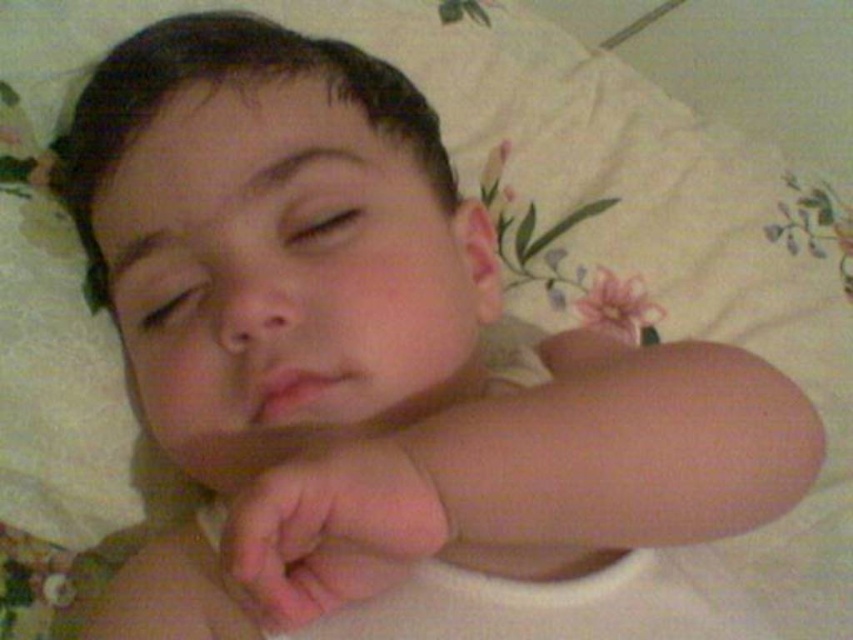
You are holding a small toy that is 10 inches wide. You want to place it on the surface where the child is lying without blocking their view. Can you fit the toy on the surface next to the point at coordinates point (219, 163)?

The point at coordinates point (219, 163) is 17.49 inches away from the viewer. Since the toy is 10 inches wide, there is enough space to place it next to the point at coordinates point (219, 163) on the surface without blocking the child.

In the scene, there are two areas labeled as pink smooth skin at center and pink flesh at center. Which one is larger in size?

The pink smooth skin at center is bigger than the pink flesh at center.

You are a photographer trying to capture a close up of the smooth skin baby at center. The baby is at point 0.372, 0.321. If your camera frame is centered at 0.5, 0.5, will the baby be in the center of your photo?

The smooth skin baby at center is positioned at point [273,237], which is slightly to the left and down from the camera frame center at [426,320]. Therefore, the baby will not be in the exact center of the photo.